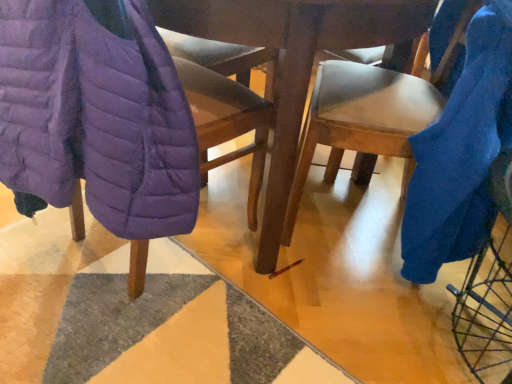
Question: Is point (48, 28) closer or farther from the camera than point (344, 147)?

Choices:
 (A) farther
 (B) closer

Answer: (B)

Question: From a real-world perspective, relative to blue fabric chair at right, positioned as the 2th chair in left-to-right order, is purple quilted jacket at left, which is the 2th blanket in right-to-left order, vertically above or below?

Choices:
 (A) below
 (B) above

Answer: (B)

Question: Which is farther from the purple quilted jacket at left, which is the 2th blanket in right-to-left order?

Choices:
 (A) purple quilted jacket at left, which ranks as the second chair in right-to-left order
 (B) blue fuzzy blanket at right, the first blanket positioned from the right
 (C) blue fabric chair at right, the first chair when ordered from right to left

Answer: (B)

Question: Estimate the real-world distances between objects in this image. Which object is closer to the purple quilted jacket at left, the 1th chair positioned from the left?

Choices:
 (A) purple quilted jacket at left, positioned as the first blanket in left-to-right order
 (B) blue fuzzy blanket at right, the first blanket positioned from the right
 (C) blue fabric chair at right, the first chair when ordered from right to left

Answer: (A)